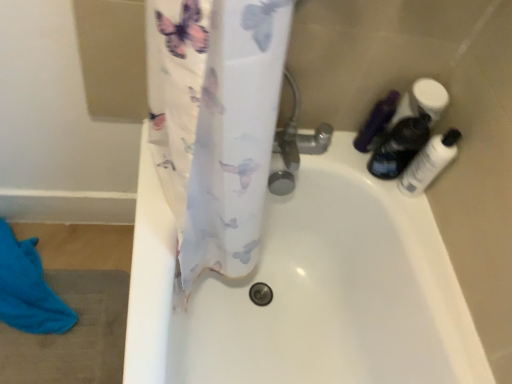
Question: From the image's perspective, is transparent plastic bottle at right, marked as the third toiletry in a left-to-right arrangement, below blue cotton beach towel at lower left?

Choices:
 (A) yes
 (B) no

Answer: (B)

Question: Does transparent plastic bottle at right, marked as the third toiletry in a left-to-right arrangement, have a lesser height compared to blue cotton beach towel at lower left?

Choices:
 (A) no
 (B) yes

Answer: (A)

Question: Does transparent plastic bottle at right, marked as the 1th toiletry in a right-to-left arrangement, lie behind blue cotton beach towel at lower left?

Choices:
 (A) no
 (B) yes

Answer: (A)

Question: Is transparent plastic bottle at right, marked as the 1th toiletry in a right-to-left arrangement, positioned in front of blue cotton beach towel at lower left?

Choices:
 (A) no
 (B) yes

Answer: (B)

Question: Is transparent plastic bottle at right, marked as the 1th toiletry in a right-to-left arrangement, outside blue cotton beach towel at lower left?

Choices:
 (A) yes
 (B) no

Answer: (A)

Question: Considering the relative positions of blue cotton beach towel at lower left and translucent plastic bottles at upper right, which is the 2th toiletry in right-to-left order, in the image provided, is blue cotton beach towel at lower left to the left or to the right of translucent plastic bottles at upper right, which is the 2th toiletry in right-to-left order,?

Choices:
 (A) right
 (B) left

Answer: (B)

Question: From a real-world perspective, is blue cotton beach towel at lower left positioned above or below translucent plastic bottles at upper right, the 2th toiletry in the left-to-right sequence?

Choices:
 (A) above
 (B) below

Answer: (B)

Question: From their relative heights in the image, would you say blue cotton beach towel at lower left is taller or shorter than translucent plastic bottles at upper right, which is the 2th toiletry in right-to-left order?

Choices:
 (A) tall
 (B) short

Answer: (B)

Question: Looking at the image, does blue cotton beach towel at lower left seem bigger or smaller compared to translucent plastic bottles at upper right, which is the 2th toiletry in right-to-left order?

Choices:
 (A) big
 (B) small

Answer: (A)

Question: Is transparent plastic bottle at right, marked as the third toiletry in a left-to-right arrangement, wider or thinner than matte black bottle at upper right, the 1th toiletry from the left?

Choices:
 (A) wide
 (B) thin

Answer: (A)

Question: Is point (416, 173) positioned closer to the camera than point (387, 107)?

Choices:
 (A) farther
 (B) closer

Answer: (B)

Question: Considering the positions of transparent plastic bottle at right, marked as the 1th toiletry in a right-to-left arrangement, and matte black bottle at upper right, the 1th toiletry from the left, in the image, is transparent plastic bottle at right, marked as the 1th toiletry in a right-to-left arrangement, bigger or smaller than matte black bottle at upper right, the 1th toiletry from the left,?

Choices:
 (A) small
 (B) big

Answer: (B)

Question: Is transparent plastic bottle at right, marked as the 1th toiletry in a right-to-left arrangement, to the left or to the right of matte black bottle at upper right, placed as the 3th toiletry when sorted from right to left, in the image?

Choices:
 (A) right
 (B) left

Answer: (A)

Question: From a real-world perspective, is translucent plastic bottles at upper right, which is the 2th toiletry in right-to-left order, physically located above or below matte black bottle at upper right, the 1th toiletry from the left?

Choices:
 (A) below
 (B) above

Answer: (B)

Question: In the image, is translucent plastic bottles at upper right, which is the 2th toiletry in right-to-left order, positioned in front of or behind matte black bottle at upper right, the 1th toiletry from the left?

Choices:
 (A) behind
 (B) front

Answer: (B)